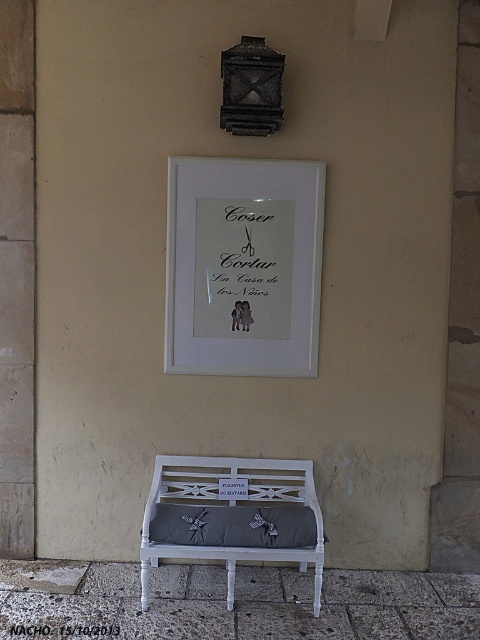
You are a painter who needs to hang a new artwork. You see the black paper at center and the white wood sign at center. Which object is shorter so you can place your artwork above it?

The black paper at center is shorter than the white wood sign at center, so you can place your artwork above the black paper at center.